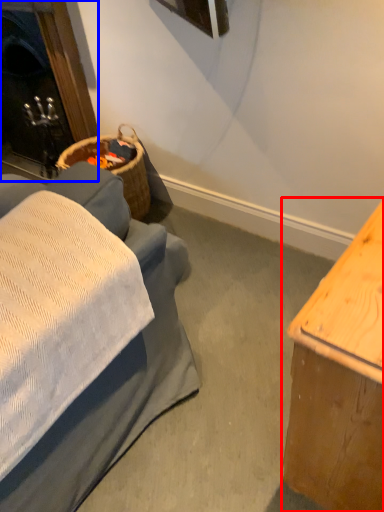
Question: Which point is closer to the camera, table (highlighted by a red box) or fireplace (highlighted by a blue box)?

Choices:
 (A) table
 (B) fireplace

Answer: (A)